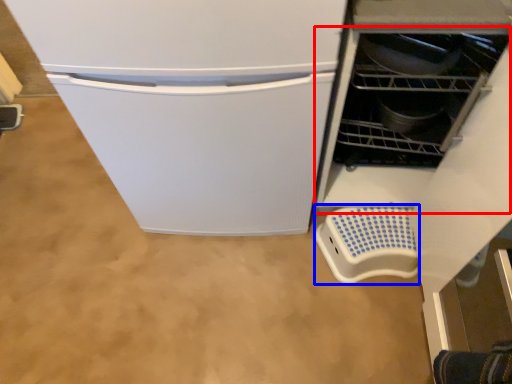
Question: Among these objects, which one is nearest to the camera, dish washer (highlighted by a red box) or appliance (highlighted by a blue box)?

Choices:
 (A) dish washer
 (B) appliance

Answer: (A)